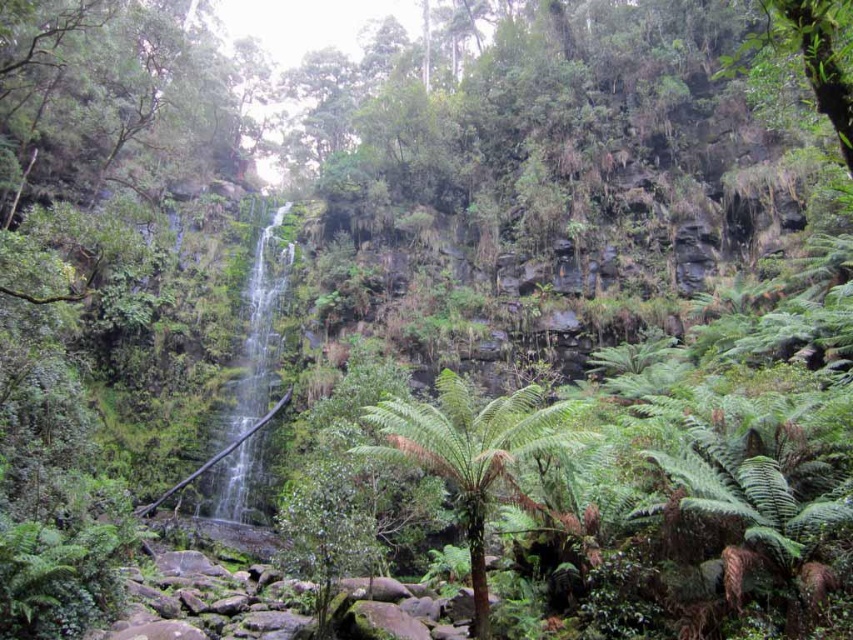
You are a hiker trying to cross the forest path. You see the green leafy fern at center and the green mossy waterfall at center. Which one is wider?

The green mossy waterfall at center is wider than the green leafy fern at center.

You are standing in the forest and see a point marked at coordinates (471,451). What object is located at that point?

The point at (471,451) indicates a green leafy fern at center.

You are a hiker who wants to take a photo of the green mossy waterfall at center. You have a camera with a standard lens that can focus on objects up close. However, you also want the green leafy fern at center to be visible in the background. Will the fern be small or large in the photo compared to the waterfall?

The green leafy fern at center has a smaller size compared to green mossy waterfall at center, so in the photo the fern will appear smaller than the waterfall.